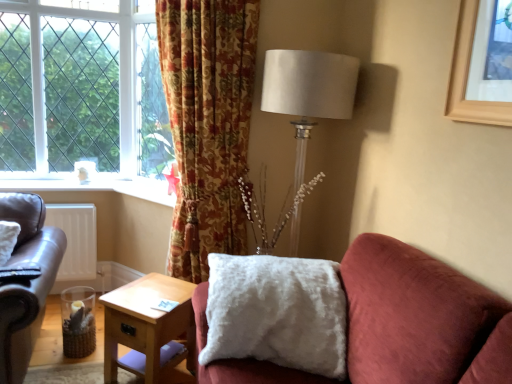
Question: Can you confirm if white matte radiator at lower left is taller than satin white lampshade at upper right?

Choices:
 (A) no
 (B) yes

Answer: (A)

Question: Is white matte radiator at lower left closer to camera compared to satin white lampshade at upper right?

Choices:
 (A) yes
 (B) no

Answer: (B)

Question: Could you tell me if white matte radiator at lower left is turned towards satin white lampshade at upper right?

Choices:
 (A) no
 (B) yes

Answer: (A)

Question: Can you confirm if white matte radiator at lower left is thinner than satin white lampshade at upper right?

Choices:
 (A) yes
 (B) no

Answer: (A)

Question: Considering the relative sizes of white matte radiator at lower left and satin white lampshade at upper right in the image provided, is white matte radiator at lower left wider than satin white lampshade at upper right?

Choices:
 (A) no
 (B) yes

Answer: (A)

Question: Is white matte radiator at lower left at the left side of satin white lampshade at upper right?

Choices:
 (A) no
 (B) yes

Answer: (B)

Question: From a real-world perspective, does white matte radiator at lower left sit lower than leather couch at left?

Choices:
 (A) yes
 (B) no

Answer: (A)

Question: Is white matte radiator at lower left oriented towards leather couch at left?

Choices:
 (A) yes
 (B) no

Answer: (A)

Question: Can you confirm if white matte radiator at lower left is positioned to the right of leather couch at left?

Choices:
 (A) no
 (B) yes

Answer: (A)

Question: Is white matte radiator at lower left bigger than leather couch at left?

Choices:
 (A) no
 (B) yes

Answer: (A)

Question: Is white matte radiator at lower left not near leather couch at left?

Choices:
 (A) no
 (B) yes

Answer: (A)

Question: Is white matte radiator at lower left in front of leather couch at left?

Choices:
 (A) no
 (B) yes

Answer: (A)

Question: Is the position of satin white lampshade at upper right less distant than that of white matte radiator at lower left?

Choices:
 (A) no
 (B) yes

Answer: (B)